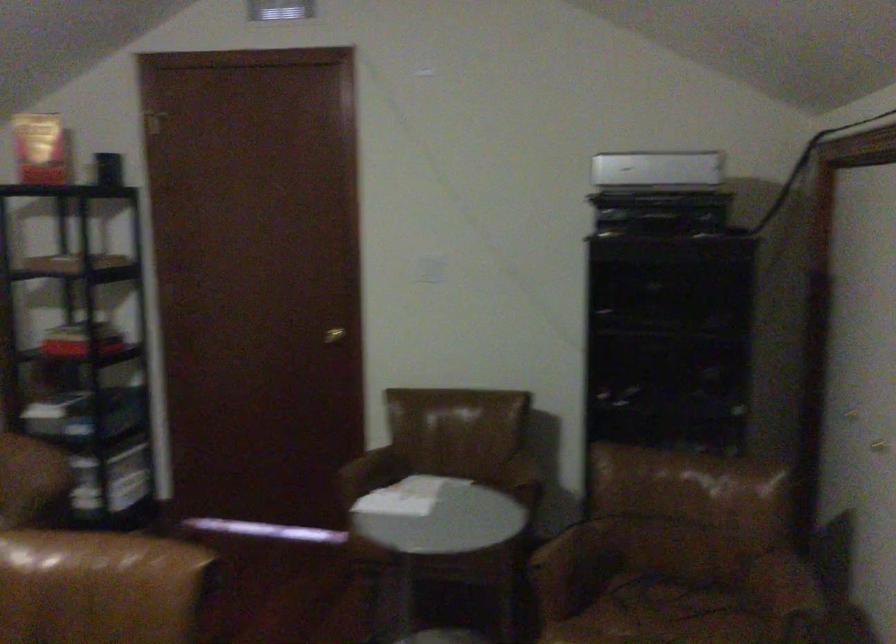
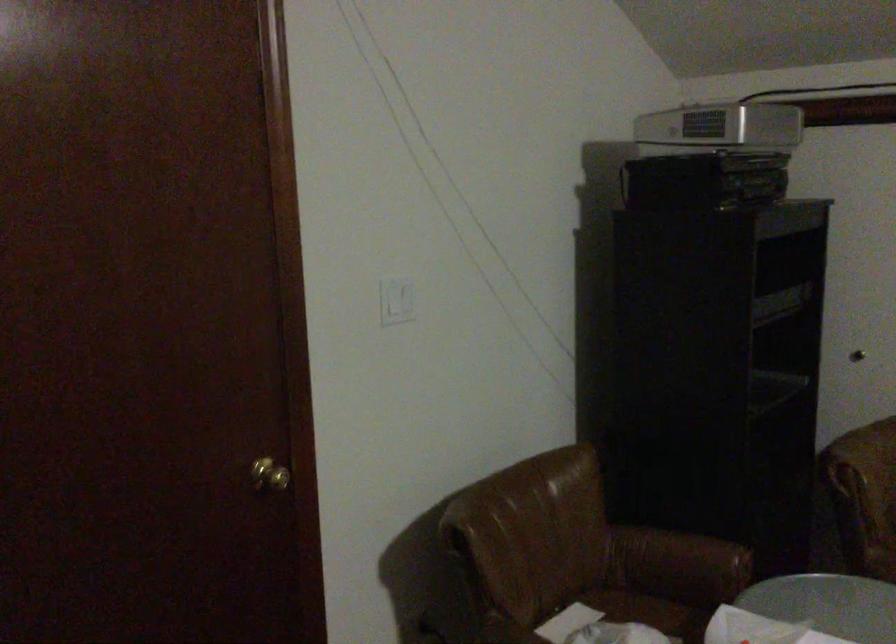
Where in the second image is the point corresponding to (613,167) from the first image?

(719, 129)